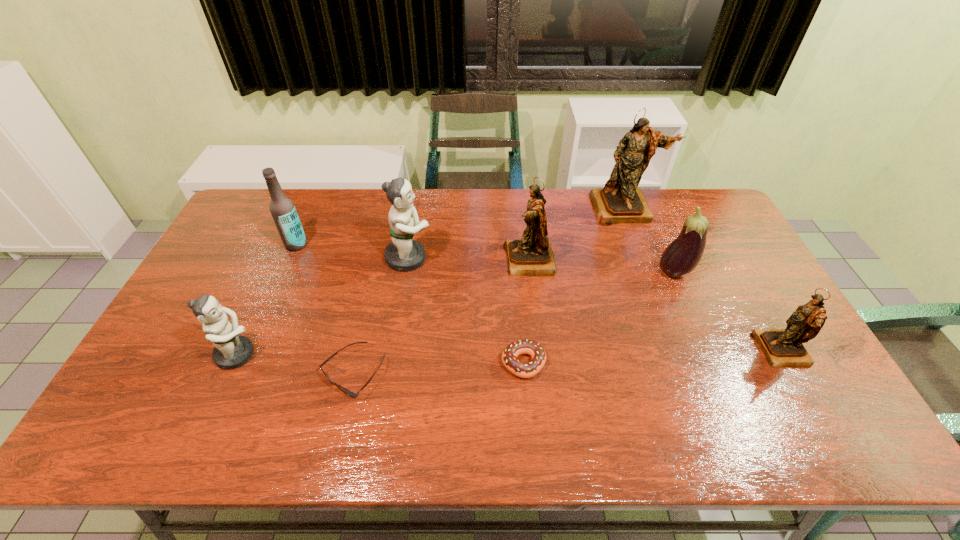
Find the location of a particular element. vacant space at the near edge is located at coordinates (226, 436).

In the image, there is a desktop. In order to click on vacant space at the left edge in this screenshot , I will do `click(142, 408)`.

At what (x,y) coordinates should I click in order to perform the action: click on vacant space at the far right corner of the desktop. Please return your answer as a coordinate pair (x, y). The height and width of the screenshot is (540, 960). Looking at the image, I should click on [690, 214].

Find the location of `free space between the leftmost gold figurine and the rightmost gold figurine`. free space between the leftmost gold figurine and the rightmost gold figurine is located at coordinates (655, 306).

Where is `free space between the bigger green figurine and the shortest object`? This screenshot has height=540, width=960. free space between the bigger green figurine and the shortest object is located at coordinates (381, 315).

Where is `vacant area that lies between the bigger green figurine and the smaller green figurine`? The image size is (960, 540). vacant area that lies between the bigger green figurine and the smaller green figurine is located at coordinates (324, 306).

The image size is (960, 540). I want to click on unoccupied area between the eggplant and the blue sunglasses, so (514, 323).

Where is `vacant area that lies between the leftmost figurine and the beer bottle`? This screenshot has width=960, height=540. vacant area that lies between the leftmost figurine and the beer bottle is located at coordinates (267, 300).

The image size is (960, 540). In order to click on free space between the left green figurine and the second smallest gold figurine in this screenshot , I will do `click(384, 307)`.

Where is `unoccupied area between the farthest figurine and the nearer green figurine`? This screenshot has width=960, height=540. unoccupied area between the farthest figurine and the nearer green figurine is located at coordinates (431, 281).